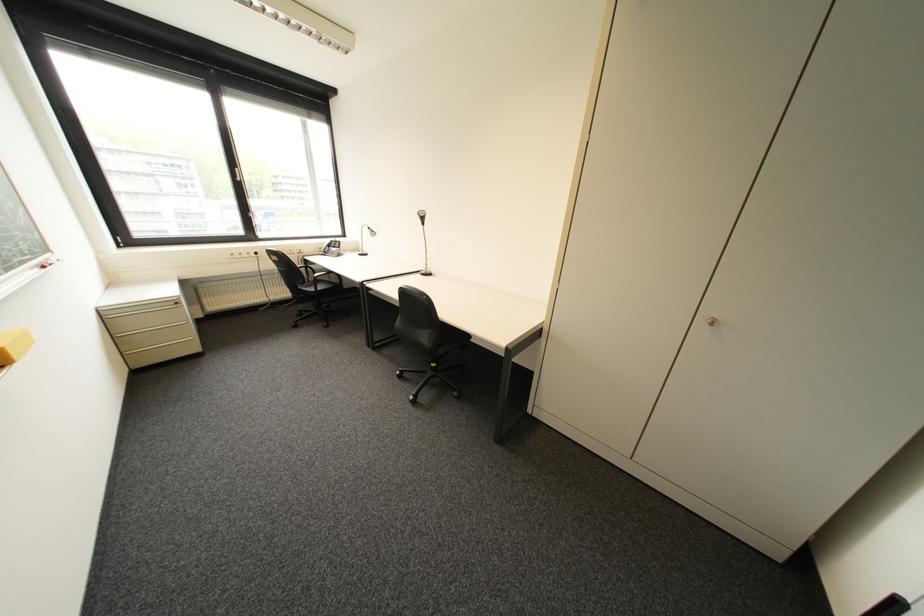
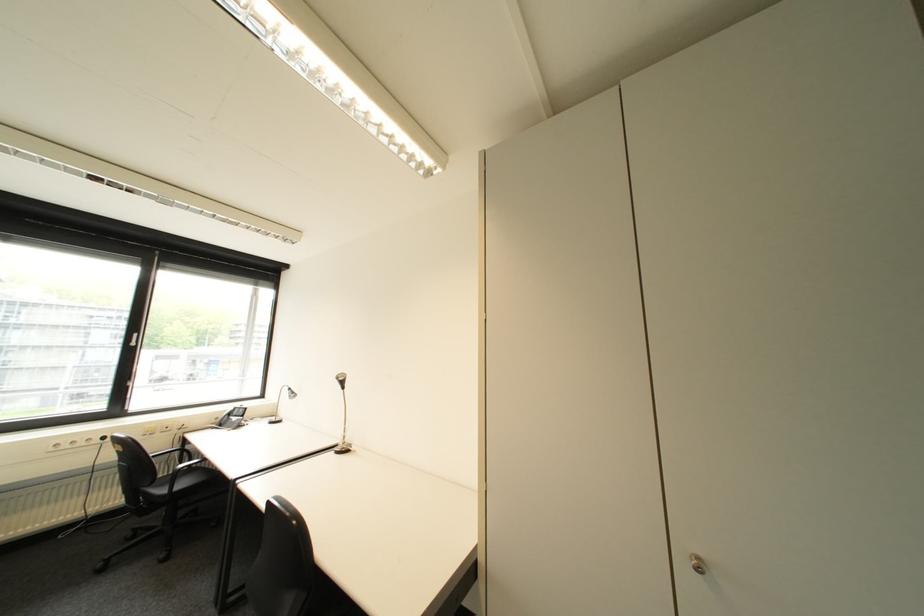
Question: The first image is from the beginning of the video and the second image is from the end. How did the camera likely rotate when shooting the video?

Choices:
 (A) Left
 (B) Right
 (C) Up
 (D) Down

Answer: (C)